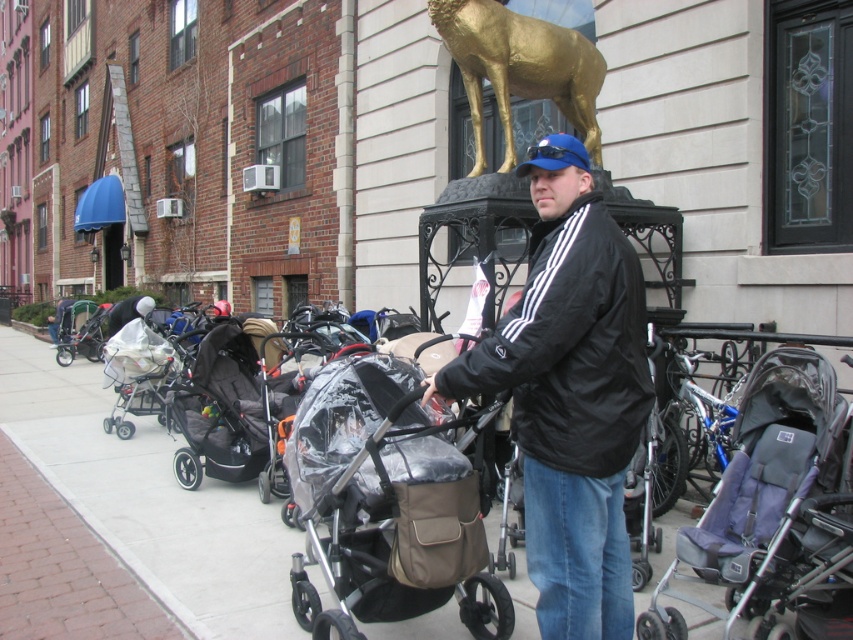
Can you confirm if gray fabric stroller at center is wider than blue fabric baseball cap at center?

Correct, the width of gray fabric stroller at center exceeds that of blue fabric baseball cap at center.

Which is below, gray fabric stroller at center or blue fabric baseball cap at center?

gray fabric stroller at center

Is point (830, 444) positioned after point (570, 147)?

That is True.

Find the location of a particular element. Image resolution: width=853 pixels, height=640 pixels. gray fabric stroller at center is located at coordinates (770, 506).

Can you confirm if black matte jacket at center is thinner than smooth concrete sidewalk at center?

Yes, black matte jacket at center is thinner than smooth concrete sidewalk at center.

Is point (598, 634) farther from viewer compared to point (47, 465)?

No, (598, 634) is closer to viewer.

The height and width of the screenshot is (640, 853). What do you see at coordinates (570, 403) in the screenshot? I see `black matte jacket at center` at bounding box center [570, 403].

Where is `black matte jacket at center`? black matte jacket at center is located at coordinates (570, 403).

Is point (575, 221) more distant than point (485, 568)?

No, (575, 221) is closer to viewer.

At what (x,y) coordinates should I click in order to perform the action: click on black matte jacket at center. Please return your answer as a coordinate pair (x, y). The height and width of the screenshot is (640, 853). Looking at the image, I should click on (570, 403).